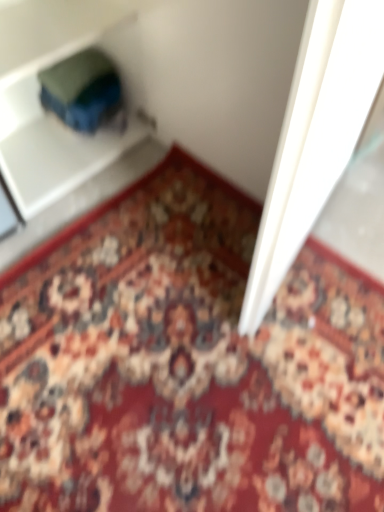
Identify the location of floral carpet at center. Image resolution: width=384 pixels, height=512 pixels. (186, 364).

This screenshot has width=384, height=512. Describe the element at coordinates (186, 364) in the screenshot. I see `floral carpet at center` at that location.

The image size is (384, 512). I want to click on floral carpet at center, so click(186, 364).